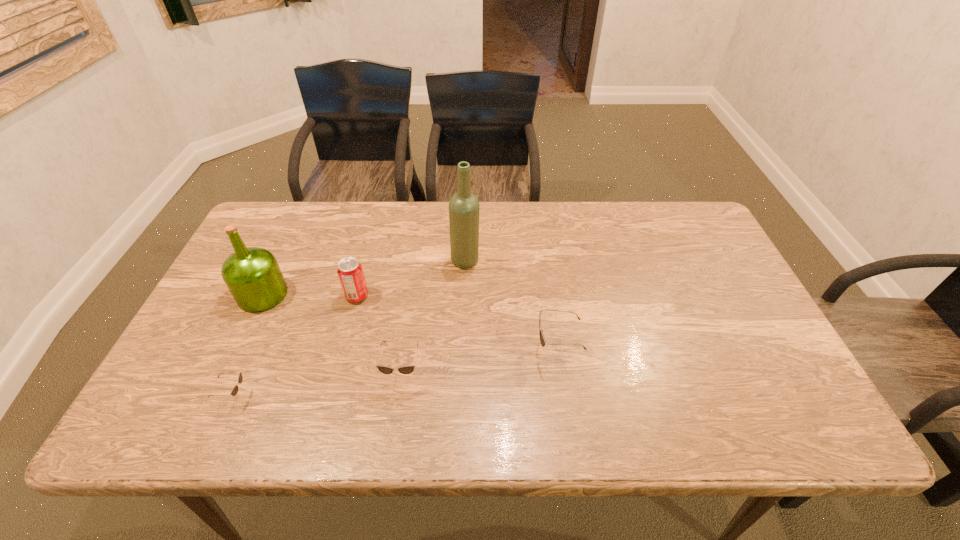
Locate an element on the screen. This screenshot has height=540, width=960. vacant space at the near edge is located at coordinates (296, 368).

In the image, there is a desktop. Where is `vacant space at the left edge`? vacant space at the left edge is located at coordinates (264, 316).

This screenshot has width=960, height=540. In the image, there is a desktop. Find the location of `vacant area at the right edge`. vacant area at the right edge is located at coordinates (721, 312).

This screenshot has width=960, height=540. I want to click on free space at the far left corner of the desktop, so click(x=298, y=244).

The height and width of the screenshot is (540, 960). Find the location of `free spot at the near left corner of the desktop`. free spot at the near left corner of the desktop is located at coordinates (233, 372).

This screenshot has width=960, height=540. In order to click on free point at the far right corner in this screenshot , I will do `click(692, 210)`.

The width and height of the screenshot is (960, 540). Identify the location of free point between the fifth tallest object and the rightmost object. (479, 361).

Find the location of a particular element. free space between the rightmost object and the olive oil is located at coordinates (410, 322).

Locate an element on the screen. The width and height of the screenshot is (960, 540). empty space between the soda and the second shortest sunglasses is located at coordinates (379, 334).

You are a GUI agent. You are given a task and a screenshot of the screen. Output one action in this format:
    pyautogui.click(x=<x>, y=<y>)
    Task: Click on the vacant area that lies between the second sunglasses from left to right and the shortest sunglasses
    The image size is (960, 540).
    Given the screenshot: What is the action you would take?
    pyautogui.click(x=318, y=384)